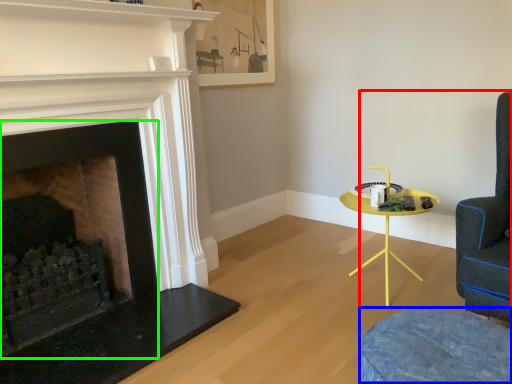
Question: Which object is positioned farthest from swivel chair (highlighted by a red box)? Select from swivel chair (highlighted by a blue box) and fireplace (highlighted by a green box).

Choices:
 (A) swivel chair
 (B) fireplace

Answer: (B)